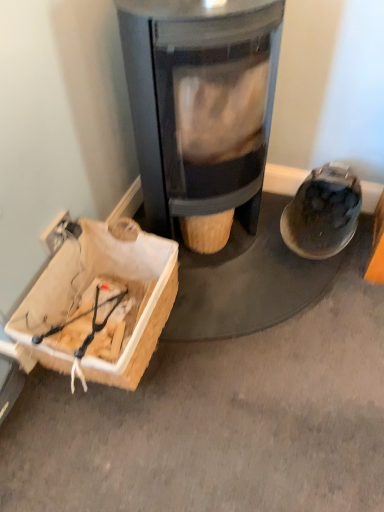
Where is `vacant area in front of matte black wood burning stove at center`? vacant area in front of matte black wood burning stove at center is located at coordinates (258, 328).